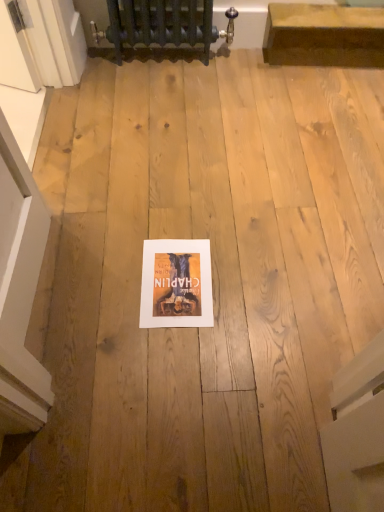
The image size is (384, 512). I want to click on matte paper poster at center, so click(x=176, y=284).

This screenshot has height=512, width=384. What do you see at coordinates (176, 284) in the screenshot?
I see `matte paper poster at center` at bounding box center [176, 284].

Locate an element on the screen. matte paper poster at center is located at coordinates (176, 284).